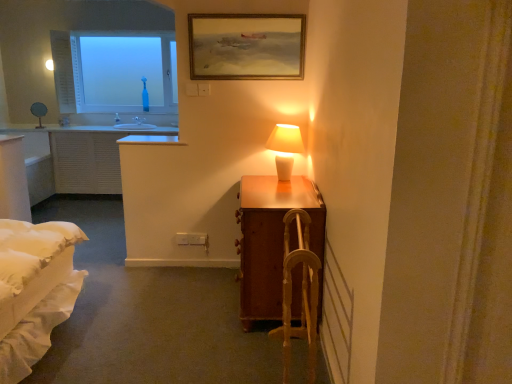
Question: From the image's perspective, is wooden suitcase at right located above or below wooden framed painting at upper center?

Choices:
 (A) above
 (B) below

Answer: (B)

Question: Is point (321, 269) closer or farther from the camera than point (203, 19)?

Choices:
 (A) farther
 (B) closer

Answer: (B)

Question: Which is nearer to the white ceramic lamp at upper right?

Choices:
 (A) wooden framed painting at upper center
 (B) wooden suitcase at right
 (C) wooden armchair at center
 (D) transparent glass bottle at upper left

Answer: (B)

Question: Which object is the farthest from the wooden suitcase at right?

Choices:
 (A) white ceramic lamp at upper right
 (B) wooden framed painting at upper center
 (C) transparent glass bottle at upper left
 (D) wooden armchair at center

Answer: (C)